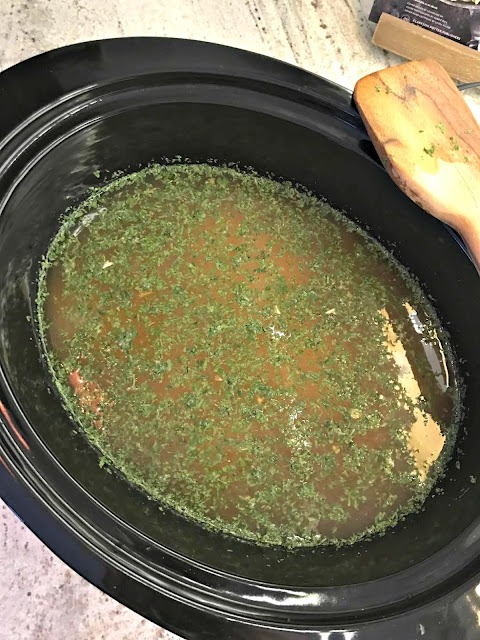
This screenshot has width=480, height=640. In order to click on oval crockpot in this screenshot , I will do `click(291, 586)`.